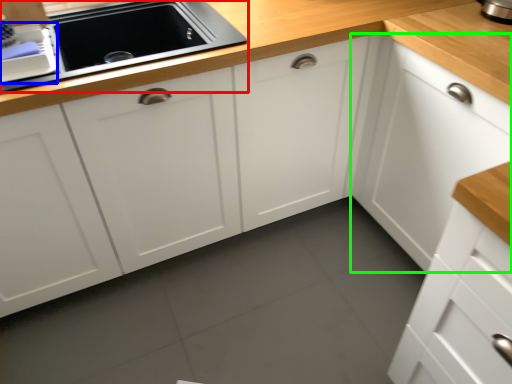
Question: Which object is positioned farthest from home appliance (highlighted by a red box)? Select from appliance (highlighted by a blue box) and cabinetry (highlighted by a green box).

Choices:
 (A) appliance
 (B) cabinetry

Answer: (B)